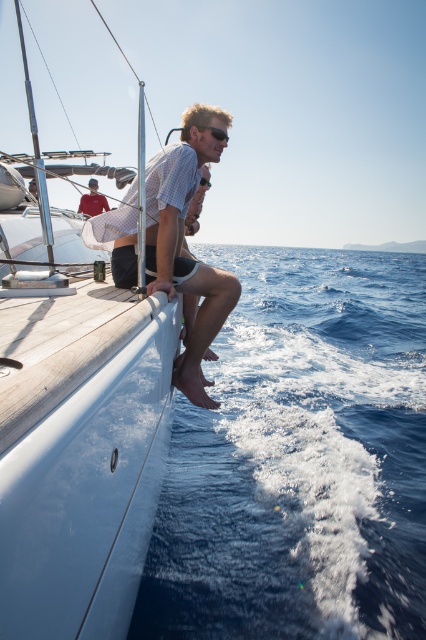
You are standing on the deck of the sailboat and want to get a closer look at the blue water at lower right. Which direction should you move relative to the light brown wood man at center?

The blue water at lower right is to the right of the light brown wood man at center, so you should move to the right side of the light brown wood man at center to get closer to the blue water at lower right.

You are standing on the sailboat deck and want to jump into the blue water at lower right. The boat has a railing that is 3 feet high. Can you safely jump into the water without hitting the railing?

The distance between the boat deck and the blue water at lower right is 8.02 feet. Since the railing is only 3 feet high, jumping over it would be possible as the vertical distance is sufficient. However, safety considerations like water depth and currents should also be taken into account.